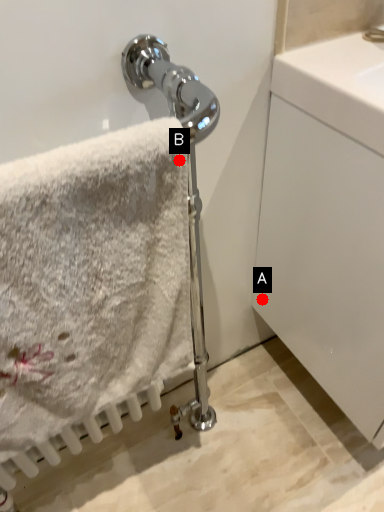
Question: Two points are circled on the image, labeled by A and B beside each circle. Which point is further to the camera?

Choices:
 (A) A is further
 (B) B is further

Answer: (A)